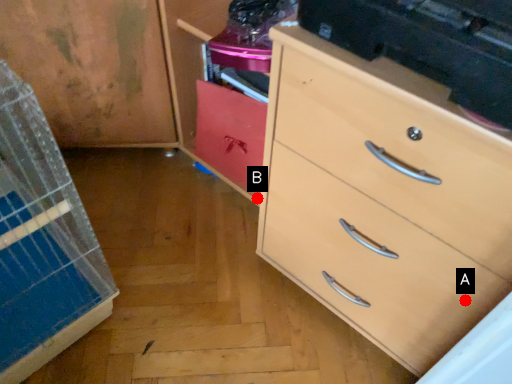
Question: Two points are circled on the image, labeled by A and B beside each circle. Which point is further to the camera?

Choices:
 (A) A is further
 (B) B is further

Answer: (B)